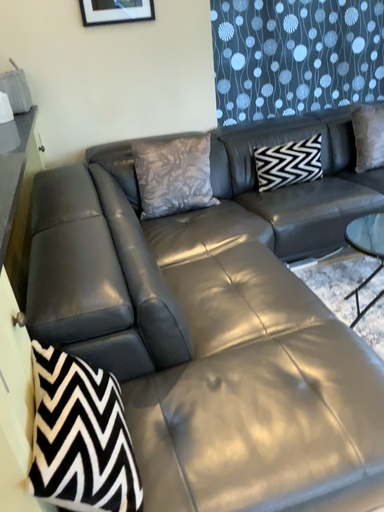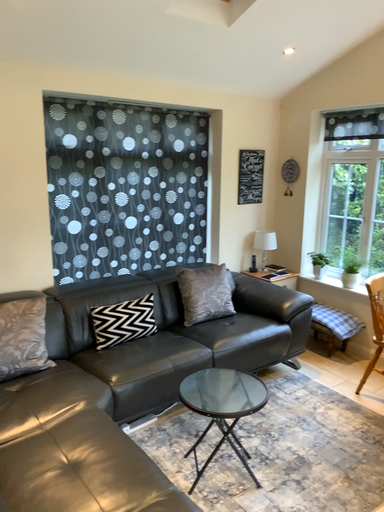
Question: How did the camera likely rotate when shooting the video?

Choices:
 (A) rotated upward
 (B) rotated downward

Answer: (A)